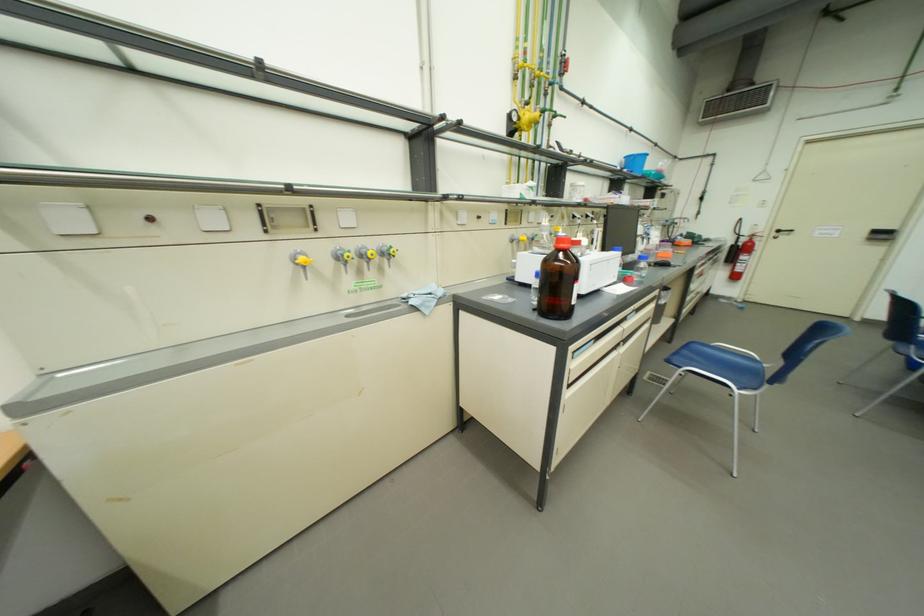
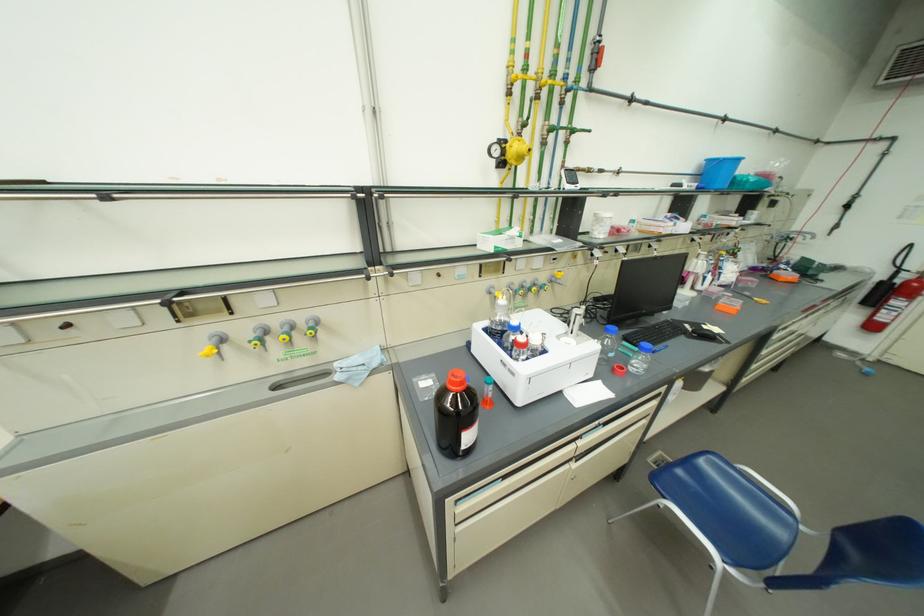
Question: The camera is either moving clockwise (left) or counter-clockwise (right) around the object. The first image is from the beginning of the video and the second image is from the end. Is the camera moving left or right when shooting the video?

Choices:
 (A) Left
 (B) Right

Answer: (B)